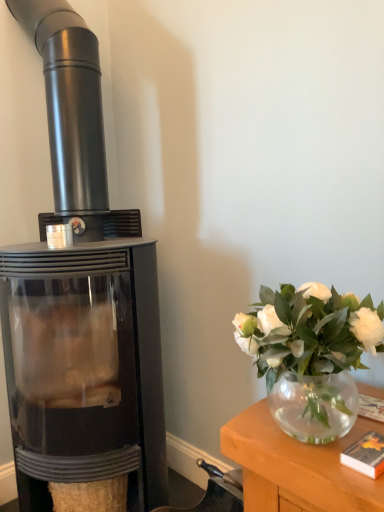
What do you see at coordinates (81, 306) in the screenshot? I see `black matte wood burning stove at left` at bounding box center [81, 306].

This screenshot has height=512, width=384. Identify the location of black matte wood burning stove at left. (81, 306).

The height and width of the screenshot is (512, 384). I want to click on black matte wood burning stove at left, so click(81, 306).